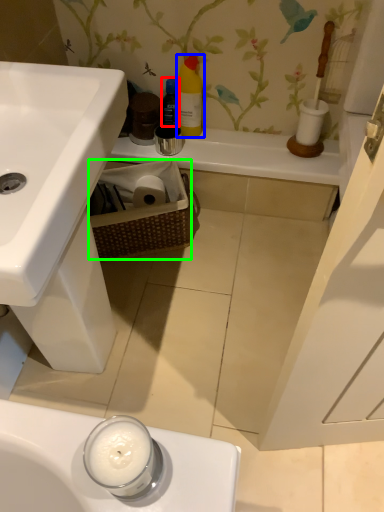
Question: Estimate the real-world distances between objects in this image. Which object is closer to bottle (highlighted by a red box), cleaning product (highlighted by a blue box) or basket (highlighted by a green box)?

Choices:
 (A) cleaning product
 (B) basket

Answer: (A)